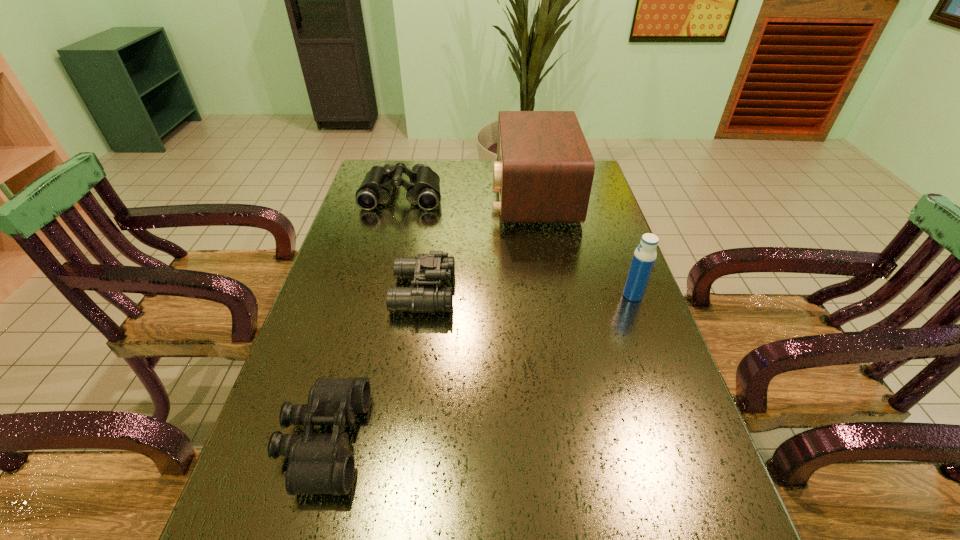
Where is `vacant space that satisfies the following two spatial constraints: 1. on the front-facing side of the farthest binoculars; 2. on the right side of the fourth shortest object`? vacant space that satisfies the following two spatial constraints: 1. on the front-facing side of the farthest binoculars; 2. on the right side of the fourth shortest object is located at coordinates (378, 295).